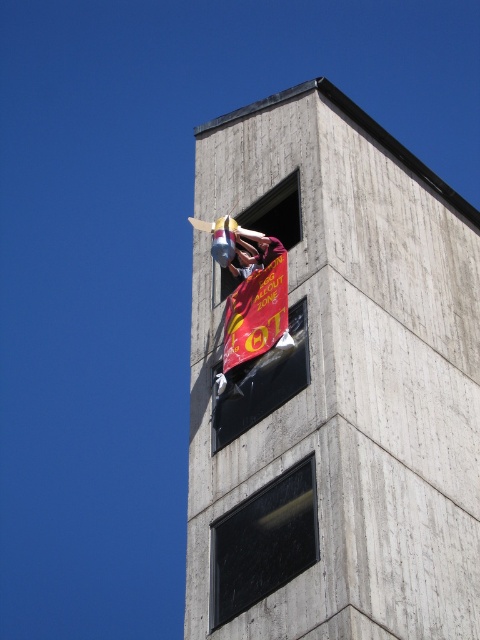
You are a delivery driver who needs to hand over a package to the recipient inside the building. The recipient is standing near the transparent glass window at lower center and the shiny metallic banner at center. Which object is closer to the recipient?

The recipient is near both the transparent glass window at lower center and the shiny metallic banner at center. Since the transparent glass window at lower center is positioned under the shiny metallic banner at center, the window is closer to the recipient than the banner.

Looking at this image, you are standing outside the building and want to see both the transparent glass window at lower center and the shiny metallic banner at center. Which object should you look at first to see them both in your field of view?

You should look at the shiny metallic banner at center first because the transparent glass window at lower center is positioned on the right side of it, so by centering your view on the banner, you can easily take in both objects within your field of view.